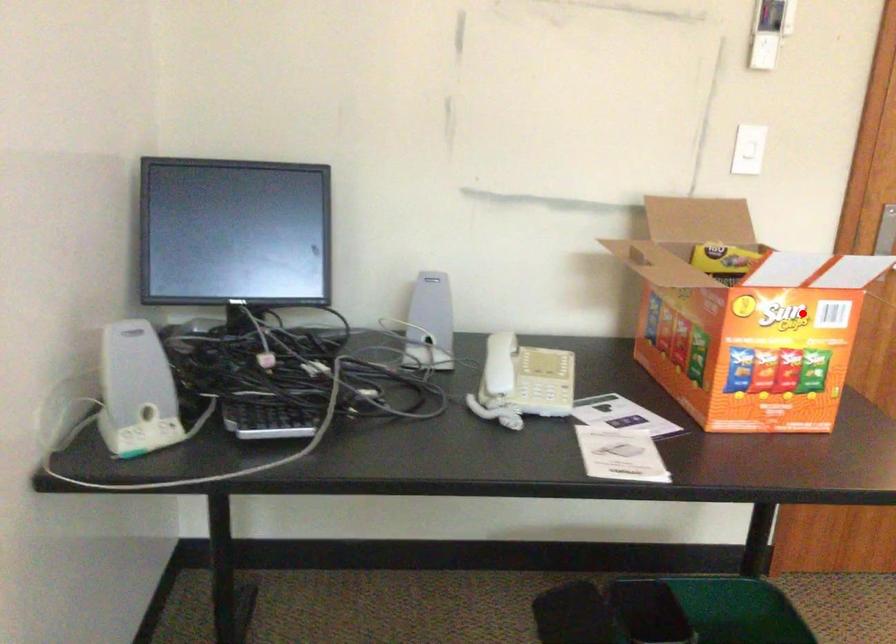
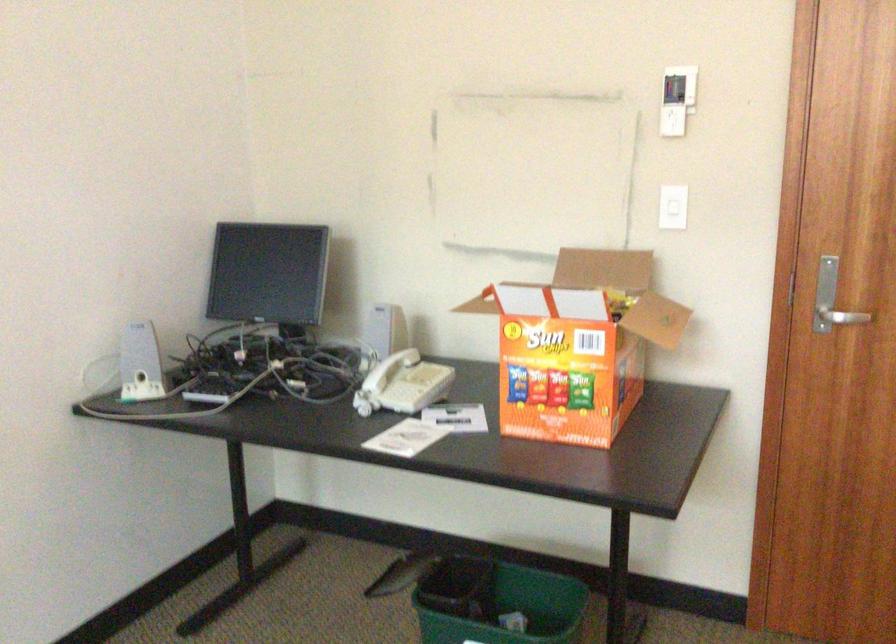
Question: I am providing you with two images of the same scene from different viewpoints. Given a red point in image1, look at the same physical point in image2. Is it:

Choices:
 (A) Closer to the viewpoint
 (B) Farther from the viewpoint

Answer: (B)